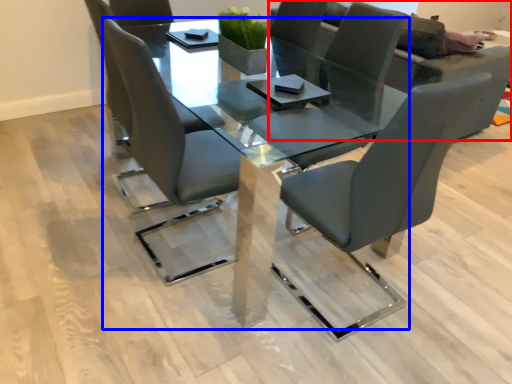
Question: Among these objects, which one is farthest to the camera, couch (highlighted by a red box) or table (highlighted by a blue box)?

Choices:
 (A) couch
 (B) table

Answer: (A)